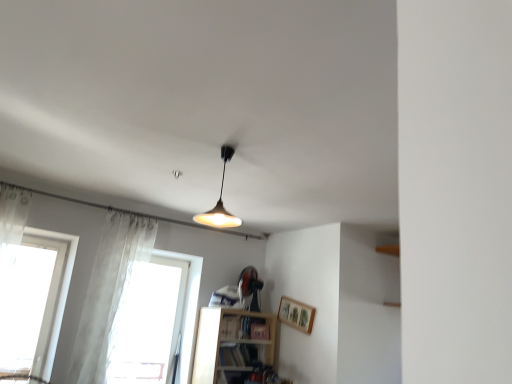
Question: From a real-world perspective, is wooden framed picture at upper right beneath matte black bookshelf at lower center, which is counted as the 2th book, starting from the bottom?

Choices:
 (A) yes
 (B) no

Answer: (B)

Question: From the image's perspective, is wooden framed picture at upper right located beneath matte black bookshelf at lower center, the 1th book in the top-to-bottom sequence?

Choices:
 (A) yes
 (B) no

Answer: (B)

Question: Is wooden framed picture at upper right next to matte black bookshelf at lower center, which is counted as the 2th book, starting from the bottom?

Choices:
 (A) no
 (B) yes

Answer: (A)

Question: From a real-world perspective, is wooden framed picture at upper right on top of matte black bookshelf at lower center, the 1th book in the top-to-bottom sequence?

Choices:
 (A) yes
 (B) no

Answer: (A)

Question: Is wooden framed picture at upper right further to the viewer compared to matte black bookshelf at lower center, which is counted as the 2th book, starting from the bottom?

Choices:
 (A) no
 (B) yes

Answer: (A)

Question: Is point (67, 261) closer or farther from the camera than point (237, 327)?

Choices:
 (A) closer
 (B) farther

Answer: (A)

Question: From the image's perspective, is white glass window at left, the 2th window positioned from the right, located above or below matte black bookshelf at lower center, the 1th book in the top-to-bottom sequence?

Choices:
 (A) below
 (B) above

Answer: (B)

Question: Considering the positions of white glass window at left, which ranks as the 1th window in left-to-right order, and matte black bookshelf at lower center, which is counted as the 2th book, starting from the bottom, in the image, is white glass window at left, which ranks as the 1th window in left-to-right order, wider or thinner than matte black bookshelf at lower center, which is counted as the 2th book, starting from the bottom,?

Choices:
 (A) thin
 (B) wide

Answer: (B)

Question: Relative to matte black bookshelf at lower center, which is counted as the 2th book, starting from the bottom, is white glass window at left, the 2th window positioned from the right, in front or behind?

Choices:
 (A) front
 (B) behind

Answer: (A)

Question: From the image's perspective, is hardcover book at lower center, the second book positioned from the top, positioned above or below matte black bookshelf at lower center, the 1th book in the top-to-bottom sequence?

Choices:
 (A) above
 (B) below

Answer: (B)

Question: Would you say hardcover book at lower center, which is the 1th book in bottom-to-top order, is to the left or to the right of matte black bookshelf at lower center, which is counted as the 2th book, starting from the bottom, in the picture?

Choices:
 (A) left
 (B) right

Answer: (A)

Question: Do you think hardcover book at lower center, which is the 1th book in bottom-to-top order, is within matte black bookshelf at lower center, which is counted as the 2th book, starting from the bottom, or outside of it?

Choices:
 (A) outside
 (B) inside

Answer: (A)

Question: Is hardcover book at lower center, which is the 1th book in bottom-to-top order, taller or shorter than matte black bookshelf at lower center, the 1th book in the top-to-bottom sequence?

Choices:
 (A) tall
 (B) short

Answer: (B)

Question: Considering the positions of point (60, 301) and point (109, 306), is point (60, 301) closer or farther from the camera than point (109, 306)?

Choices:
 (A) closer
 (B) farther

Answer: (A)

Question: Looking at the image, does white glass window at left, which ranks as the 1th window in left-to-right order, seem bigger or smaller compared to translucent fabric curtain at left?

Choices:
 (A) big
 (B) small

Answer: (A)